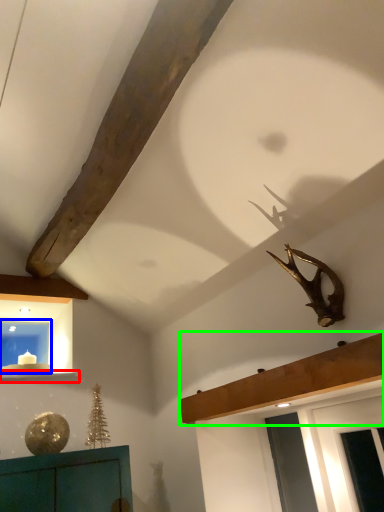
Question: Considering the real-world distances, which object is closest to window sill (highlighted by a red box)? window (highlighted by a blue box) or shelf (highlighted by a green box).

Choices:
 (A) window
 (B) shelf

Answer: (A)